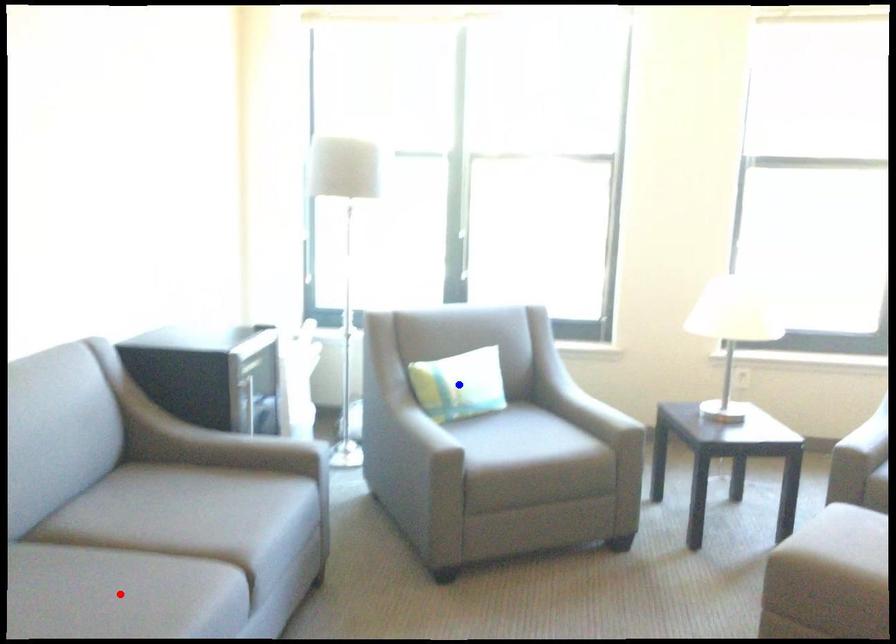
Question: In the image, two points are highlighted. Which point is nearer to the camera? Reply with the corresponding letter.

Choices:
 (A) blue point
 (B) red point

Answer: (B)